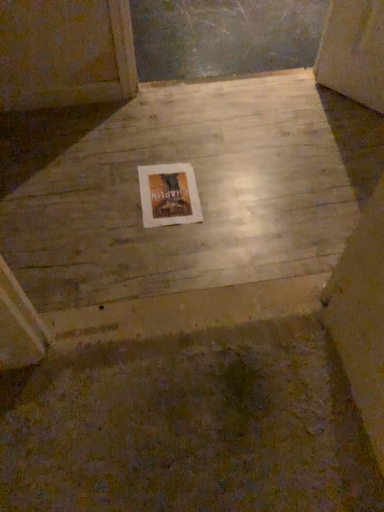
Where is `free point above smooth concrete floor at center (from a real-world perspective)`? The image size is (384, 512). free point above smooth concrete floor at center (from a real-world perspective) is located at coordinates (201, 184).